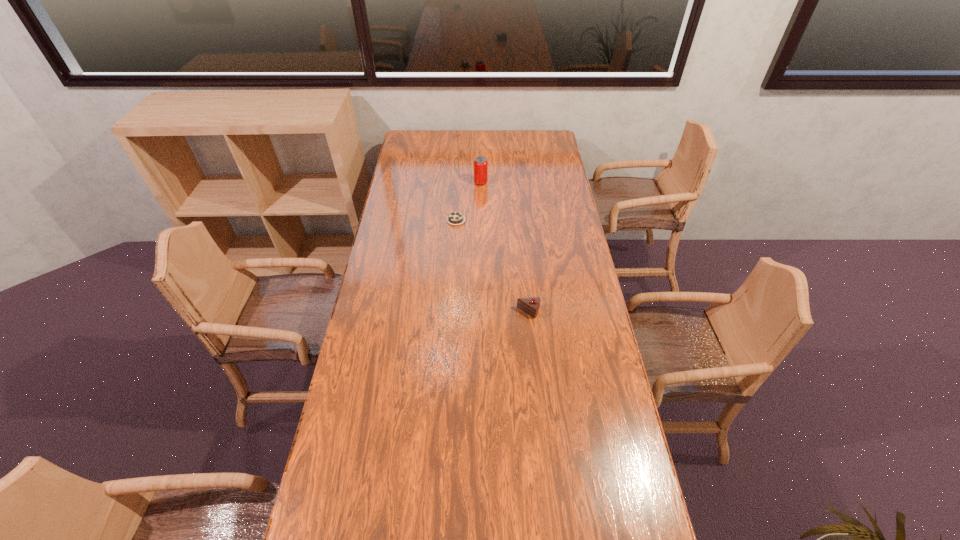
You are a GUI agent. You are given a task and a screenshot of the screen. Output one action in this format:
    pyautogui.click(x=<x>, y=<y>)
    Task: Click on the vacant space at the right edge
    
    Given the screenshot: What is the action you would take?
    pyautogui.click(x=566, y=197)

The height and width of the screenshot is (540, 960). In order to click on vacant space at the far left corner in this screenshot , I will do `click(405, 147)`.

At what (x,y) coordinates should I click in order to perform the action: click on vacant point located between the tallest object and the left chocolate cake. Please return your answer as a coordinate pair (x, y). The image size is (960, 540). Looking at the image, I should click on (468, 201).

I want to click on vacant space in between the shortest object and the nearer chocolate cake, so click(492, 266).

The width and height of the screenshot is (960, 540). Find the location of `vacant region between the taller chocolate cake and the leftmost object`. vacant region between the taller chocolate cake and the leftmost object is located at coordinates (492, 266).

Identify the location of free spot between the leftmost object and the can. Image resolution: width=960 pixels, height=540 pixels. (468, 201).

The image size is (960, 540). Identify the location of free space between the tallest object and the shorter chocolate cake. (468, 201).

Identify which object is the second nearest to the taller chocolate cake. Please provide its 2D coordinates. Your answer should be formatted as a tuple, i.e. [(x, y)], where the tuple contains the x and y coordinates of a point satisfying the conditions above.

[(480, 163)]

Point out which object is positioned as the second nearest to the nearer chocolate cake. Please provide its 2D coordinates. Your answer should be formatted as a tuple, i.e. [(x, y)], where the tuple contains the x and y coordinates of a point satisfying the conditions above.

[(480, 163)]

I want to click on blank area in the image that satisfies the following two spatial constraints: 1. on the front side of the leftmost object; 2. on the right side of the taller chocolate cake, so click(451, 312).